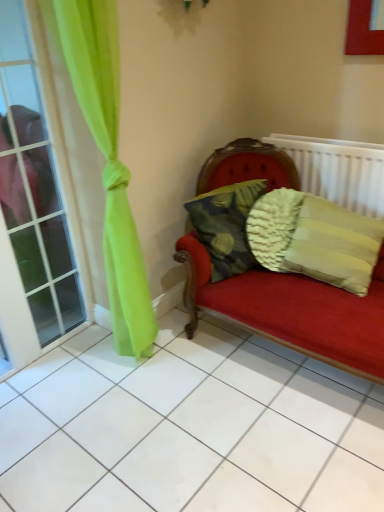
Question: Is textured beige pillow at right, arranged as the first pillow when viewed from the right, facing towards camouflage fabric pillow at center, the 1th pillow positioned from the left?

Choices:
 (A) yes
 (B) no

Answer: (B)

Question: Is textured beige pillow at right, arranged as the first pillow when viewed from the right, touching camouflage fabric pillow at center, the 1th pillow positioned from the left?

Choices:
 (A) no
 (B) yes

Answer: (A)

Question: Is textured beige pillow at right, arranged as the first pillow when viewed from the right, completely or partially outside of camouflage fabric pillow at center, positioned as the 2th pillow in right-to-left order?

Choices:
 (A) yes
 (B) no

Answer: (A)

Question: Is textured beige pillow at right, arranged as the second pillow when viewed from the left, far from camouflage fabric pillow at center, the 1th pillow positioned from the left?

Choices:
 (A) yes
 (B) no

Answer: (B)

Question: Does textured beige pillow at right, arranged as the second pillow when viewed from the left, appear on the left side of camouflage fabric pillow at center, the 1th pillow positioned from the left?

Choices:
 (A) yes
 (B) no

Answer: (B)

Question: Considering the relative positions of textured beige pillow at right, arranged as the first pillow when viewed from the right, and camouflage fabric pillow at center, the 1th pillow positioned from the left, in the image provided, is textured beige pillow at right, arranged as the first pillow when viewed from the right, to the right of camouflage fabric pillow at center, the 1th pillow positioned from the left, from the viewer's perspective?

Choices:
 (A) no
 (B) yes

Answer: (B)

Question: Is white textured radiator at upper right wider than textured beige pillow at right, arranged as the first pillow when viewed from the right?

Choices:
 (A) no
 (B) yes

Answer: (A)

Question: Is white textured radiator at upper right smaller than textured beige pillow at right, arranged as the second pillow when viewed from the left?

Choices:
 (A) yes
 (B) no

Answer: (A)

Question: From the image's perspective, would you say white textured radiator at upper right is positioned over textured beige pillow at right, arranged as the first pillow when viewed from the right?

Choices:
 (A) yes
 (B) no

Answer: (A)

Question: From a real-world perspective, is white textured radiator at upper right over textured beige pillow at right, arranged as the first pillow when viewed from the right?

Choices:
 (A) yes
 (B) no

Answer: (A)

Question: Considering the relative positions of white textured radiator at upper right and textured beige pillow at right, arranged as the first pillow when viewed from the right, in the image provided, is white textured radiator at upper right to the right of textured beige pillow at right, arranged as the first pillow when viewed from the right, from the viewer's perspective?

Choices:
 (A) no
 (B) yes

Answer: (B)

Question: Does white textured radiator at upper right have a larger size compared to textured beige pillow at right, arranged as the second pillow when viewed from the left?

Choices:
 (A) yes
 (B) no

Answer: (B)

Question: Is clear glass window at left to the right of textured beige pillow at right, arranged as the first pillow when viewed from the right, from the viewer's perspective?

Choices:
 (A) yes
 (B) no

Answer: (B)